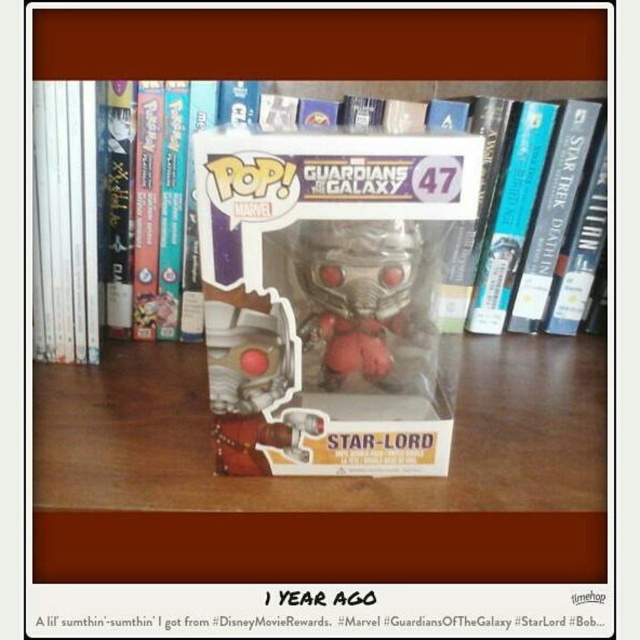
You are trying to place a new small decorative item on the shelf where the clear plastic pop vinyl figure at center and the metallic silver helmet at center are located. If the new item requires at least 10 cm of space, is there enough space between these two objects?

The clear plastic pop vinyl figure at center might be wider than metallic silver helmet at center, so there might not be enough space between them for the new item requiring 10 cm of space. Check the actual width before placing the item.

You are a collector who wants to place a new Funko Pop! figure on a shelf that has limited space. The shelf can only accommodate items that are 30 centimeters wide. You see the clear plastic pop vinyl figure at center and the metallic silver helmet at center. Can both items fit side by side on the shelf without exceeding the width limit?

The clear plastic pop vinyl figure at center and the metallic silver helmet at center are 37.71 centimeters apart, which exceeds the 30 centimeter width limit of the shelf. Therefore, both items cannot fit side by side on the shelf.